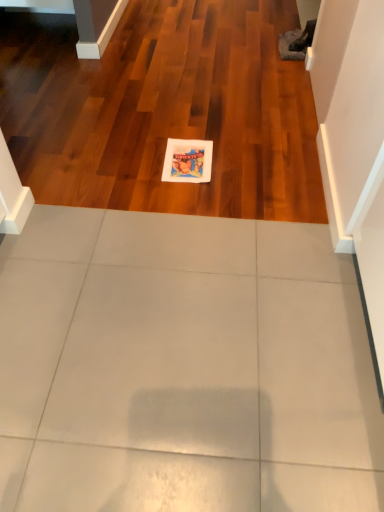
The height and width of the screenshot is (512, 384). What do you see at coordinates (187, 161) in the screenshot?
I see `matte paper postcard at center` at bounding box center [187, 161].

Where is `matte paper postcard at center`? This screenshot has height=512, width=384. matte paper postcard at center is located at coordinates (187, 161).

What is the approximate width of white glossy tile at center?

The width of white glossy tile at center is 7.31 feet.

In order to click on white glossy tile at center in this screenshot , I will do `click(183, 367)`.

What do you see at coordinates (183, 367) in the screenshot? I see `white glossy tile at center` at bounding box center [183, 367].

The height and width of the screenshot is (512, 384). I want to click on matte paper postcard at center, so click(x=187, y=161).

Which is more to the right, matte paper postcard at center or white glossy tile at center?

matte paper postcard at center.

Which is behind, matte paper postcard at center or white glossy tile at center?

matte paper postcard at center is behind.

Which point is more distant from viewer, (194, 160) or (7, 285)?

The point (194, 160) is behind.

From the image's perspective, is matte paper postcard at center over white glossy tile at center?

Actually, matte paper postcard at center appears below white glossy tile at center in the image.

From a real-world perspective, is matte paper postcard at center physically above white glossy tile at center?

Yes.

Considering the relative sizes of matte paper postcard at center and white glossy tile at center in the image provided, is matte paper postcard at center thinner than white glossy tile at center?

Correct, the width of matte paper postcard at center is less than that of white glossy tile at center.

Considering the sizes of objects matte paper postcard at center and white glossy tile at center in the image provided, who is shorter, matte paper postcard at center or white glossy tile at center?

With less height is matte paper postcard at center.

Considering the sizes of objects matte paper postcard at center and white glossy tile at center in the image provided, who is smaller, matte paper postcard at center or white glossy tile at center?

With smaller size is matte paper postcard at center.

Would you say white glossy tile at center is part of matte paper postcard at center's contents?

No, white glossy tile at center is located outside of matte paper postcard at center.

Based on the photo, is the surface of matte paper postcard at center in direct contact with white glossy tile at center?

No.

Is matte paper postcard at center aimed at white glossy tile at center?

Yes, matte paper postcard at center is turned towards white glossy tile at center.

How many degrees apart are the facing directions of matte paper postcard at center and white glossy tile at center?

The angular difference between matte paper postcard at center and white glossy tile at center is 92.1 degrees.

At what (x,y) coordinates should I click in order to perform the action: click on ceramic tile above the matte paper postcard at center (from the image's perspective). Please return your answer as a coordinate pair (x, y). Looking at the image, I should click on (183, 367).

Which is more to the left, white glossy tile at center or matte paper postcard at center?

Positioned to the left is white glossy tile at center.

Is white glossy tile at center behind matte paper postcard at center?

That is False.

Which is less distant, [251,261] or [166,163]?

Clearly, point [251,261] is closer to the camera than point [166,163].

From the image's perspective, is white glossy tile at center positioned above or below matte paper postcard at center?

Clearly, from the image's perspective, white glossy tile at center is above matte paper postcard at center.

From a real-world perspective, is white glossy tile at center physically below matte paper postcard at center?

Yes, from a real-world perspective, white glossy tile at center is under matte paper postcard at center.

Is white glossy tile at center wider than matte paper postcard at center?

Yes, white glossy tile at center is wider than matte paper postcard at center.

Considering the relative sizes of white glossy tile at center and matte paper postcard at center in the image provided, is white glossy tile at center taller than matte paper postcard at center?

Correct, white glossy tile at center is much taller as matte paper postcard at center.

Can you confirm if white glossy tile at center is bigger than matte paper postcard at center?

Indeed, white glossy tile at center has a larger size compared to matte paper postcard at center.

Is white glossy tile at center not within matte paper postcard at center?

Indeed, white glossy tile at center is completely outside matte paper postcard at center.

Are white glossy tile at center and matte paper postcard at center far apart?

They are positioned close to each other.

In the scene shown: Could you tell me if white glossy tile at center is turned towards matte paper postcard at center?

No, white glossy tile at center is not oriented towards matte paper postcard at center.

Image resolution: width=384 pixels, height=512 pixels. I want to click on postcard below the white glossy tile at center (from the image's perspective), so (187, 161).

This screenshot has width=384, height=512. Identify the location of postcard located on the right of white glossy tile at center. (187, 161).

In order to click on ceramic tile that is in front of the matte paper postcard at center in this screenshot , I will do point(183,367).